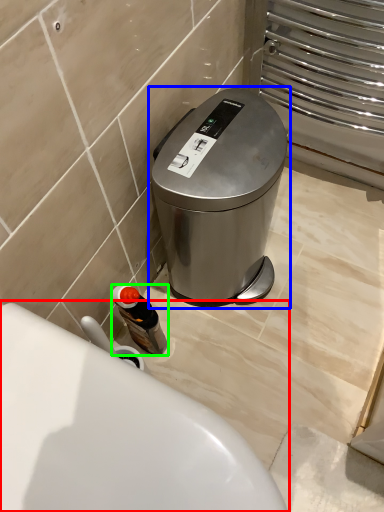
Question: Which is farther away from toilet (highlighted by a red box)? waste container (highlighted by a blue box) or bottle (highlighted by a green box)?

Choices:
 (A) waste container
 (B) bottle

Answer: (A)